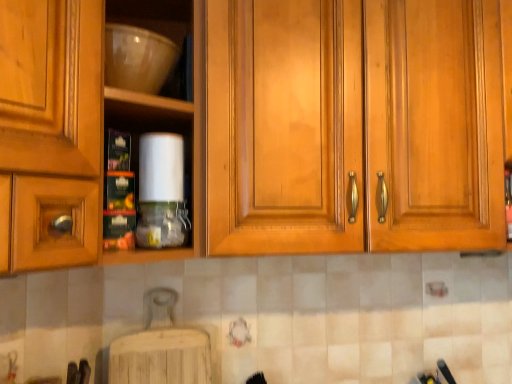
Question: In terms of height, does matte wood cabinets at center look taller or shorter compared to matte white bowl at upper left?

Choices:
 (A) short
 (B) tall

Answer: (B)

Question: In the image, is matte wood cabinets at center positioned in front of or behind matte white bowl at upper left?

Choices:
 (A) front
 (B) behind

Answer: (B)

Question: Which object is the closest to the matte wood cabinets at center?

Choices:
 (A) translucent plastic bottle at center
 (B) matte white bowl at upper left

Answer: (A)

Question: Based on their relative distances, which object is farther from the matte white bowl at upper left?

Choices:
 (A) translucent plastic bottle at center
 (B) matte wood cabinets at center

Answer: (A)